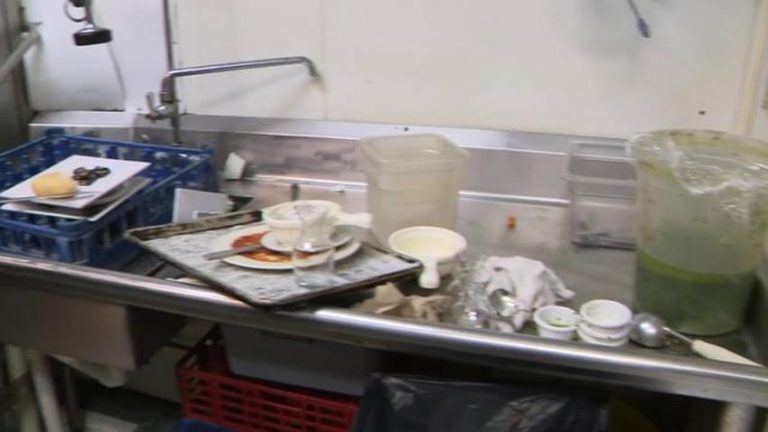
Find the location of `silverware`. silverware is located at coordinates (223, 252), (15, 196).